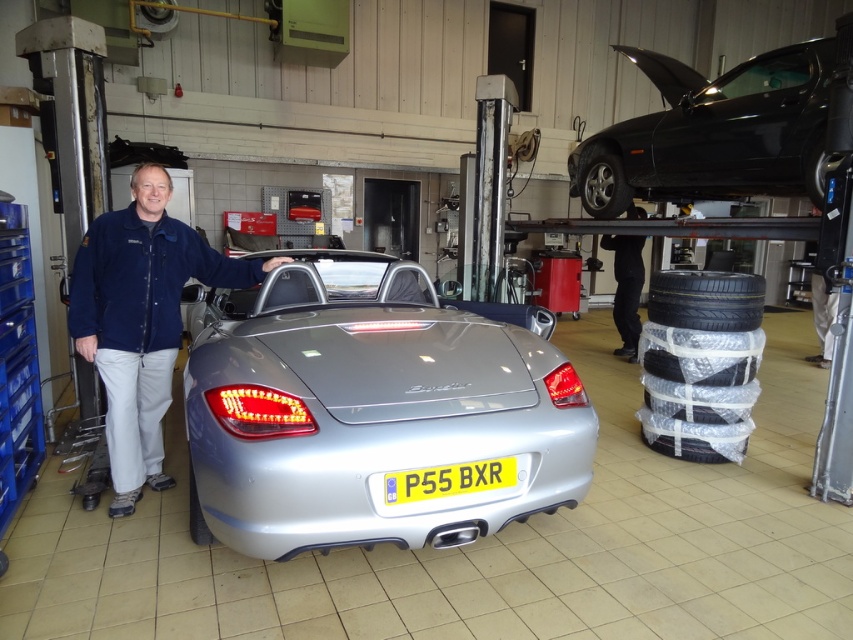
You are a photographer setting up a shoot in this garage. You have a camera that can only focus on objects larger than 1 meter in height. Looking at the shiny black car at upper right and the silver metallic tire at lower left, which object should you choose to ensure your camera can focus on it?

The shiny black car at upper right is bigger than the silver metallic tire at lower left, so the camera should focus on the shiny black car at upper right since it is larger than 1 meter in height.

You are standing in the garage and see two points marked in the scene. Which point, point (x=397, y=490) or point (x=624, y=205), is closer to you?

Point (x=397, y=490) is closer to the viewer than point (x=624, y=205).